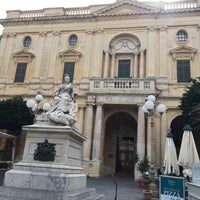
I want to click on decorative windows, so click(x=27, y=42), click(x=72, y=41), click(x=185, y=35).